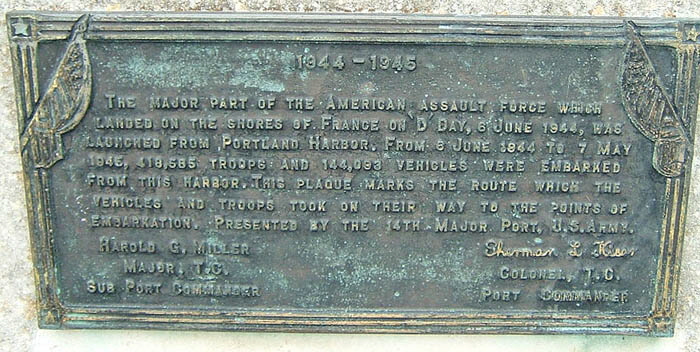
I want to click on top left corner of plaque, so click(x=21, y=29).